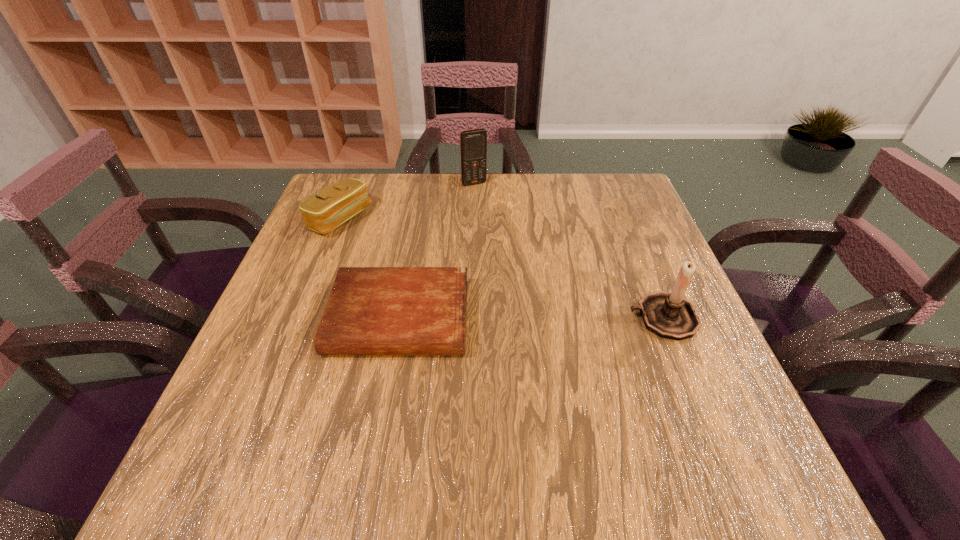
Find the location of a particular element. free space located on the zipper side of the third nearest object is located at coordinates coord(383,245).

In order to click on vacant area situated 0.210m on the zipper side of the third nearest object in this screenshot , I will do `click(419, 265)`.

The width and height of the screenshot is (960, 540). Find the location of `vacant space located on the zipper side of the third nearest object`. vacant space located on the zipper side of the third nearest object is located at coordinates (409, 259).

Find the location of a particular element. The image size is (960, 540). cellular telephone located in the far edge section of the desktop is located at coordinates (473, 143).

Identify the location of clutch bag that is positioned at the far edge. (337, 203).

At what (x,y) coordinates should I click in order to perform the action: click on Bible located at the left edge. Please return your answer as a coordinate pair (x, y). The image size is (960, 540). Looking at the image, I should click on (371, 310).

At what (x,y) coordinates should I click in order to perform the action: click on clutch bag that is at the left edge. Please return your answer as a coordinate pair (x, y). This screenshot has height=540, width=960. Looking at the image, I should click on (337, 203).

Image resolution: width=960 pixels, height=540 pixels. In order to click on object located in the right edge section of the desktop in this screenshot , I will do `click(668, 315)`.

Find the location of a particular element. The width and height of the screenshot is (960, 540). object situated at the far left corner is located at coordinates (337, 203).

This screenshot has width=960, height=540. I want to click on vacant space at the far edge of the desktop, so click(519, 200).